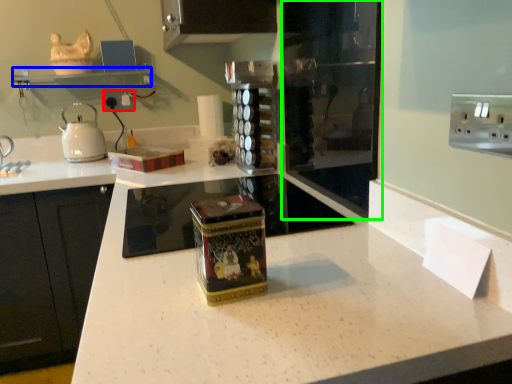
Question: Considering the real-world distances, which object is farthest from electric outlet (highlighted by a red box)? shelf (highlighted by a blue box) or glass door (highlighted by a green box)?

Choices:
 (A) shelf
 (B) glass door

Answer: (B)